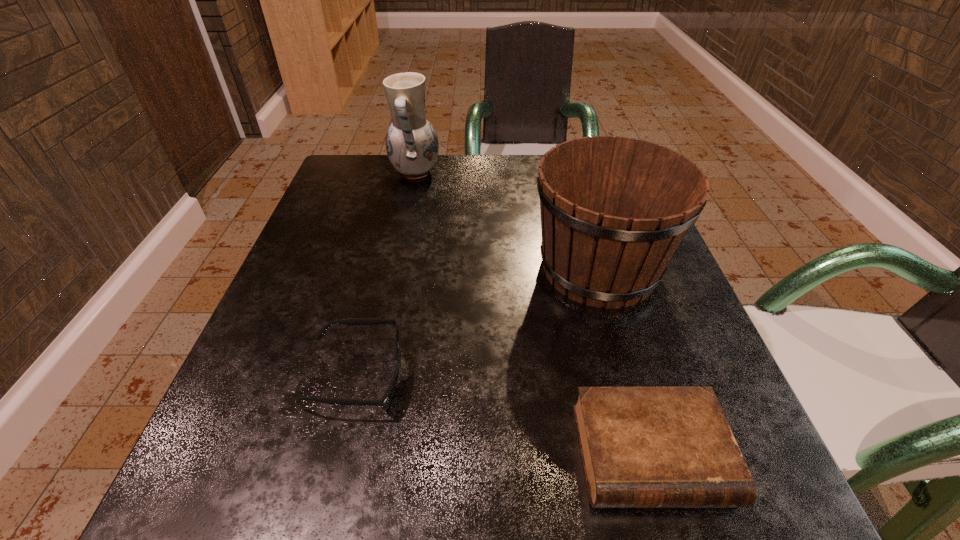
Image resolution: width=960 pixels, height=540 pixels. I want to click on sunglasses located at the left edge, so click(x=386, y=399).

The width and height of the screenshot is (960, 540). Identify the location of wine bucket present at the right edge. (614, 210).

You are a GUI agent. You are given a task and a screenshot of the screen. Output one action in this format:
    pyautogui.click(x=<x>, y=<y>)
    Task: Click on the diary present at the right edge
    Image resolution: width=960 pixels, height=540 pixels.
    Given the screenshot: What is the action you would take?
    pyautogui.click(x=642, y=447)

Find the location of `object present at the far left corner`. object present at the far left corner is located at coordinates (412, 146).

Find the location of a particular element. The height and width of the screenshot is (540, 960). object present at the near right corner is located at coordinates (642, 447).

Identify the location of free space at the far edge. Image resolution: width=960 pixels, height=540 pixels. (505, 184).

Image resolution: width=960 pixels, height=540 pixels. Find the location of `free space at the near edge of the desktop`. free space at the near edge of the desktop is located at coordinates (378, 487).

This screenshot has width=960, height=540. In the image, there is a desktop. What are the coordinates of `vacant region at the left edge` in the screenshot? It's located at (363, 265).

This screenshot has width=960, height=540. In the image, there is a desktop. Find the location of `vacant space at the right edge`. vacant space at the right edge is located at coordinates (712, 376).

In the image, there is a desktop. Where is `vacant area at the near left corner`? vacant area at the near left corner is located at coordinates (281, 525).